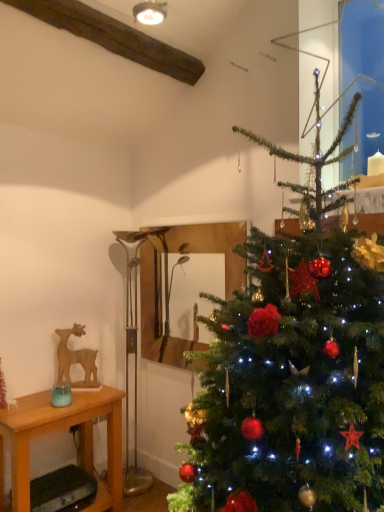
Find the location of `empty space that is ontop of wooden table at left (from a real-world perspective)`. empty space that is ontop of wooden table at left (from a real-world perspective) is located at coordinates (49, 401).